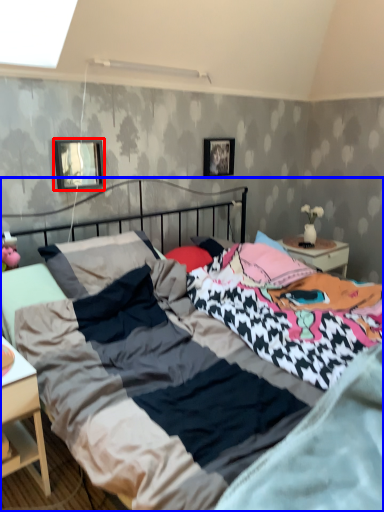
Question: Among these objects, which one is farthest to the camera, picture frame (highlighted by a red box) or bed (highlighted by a blue box)?

Choices:
 (A) picture frame
 (B) bed

Answer: (A)